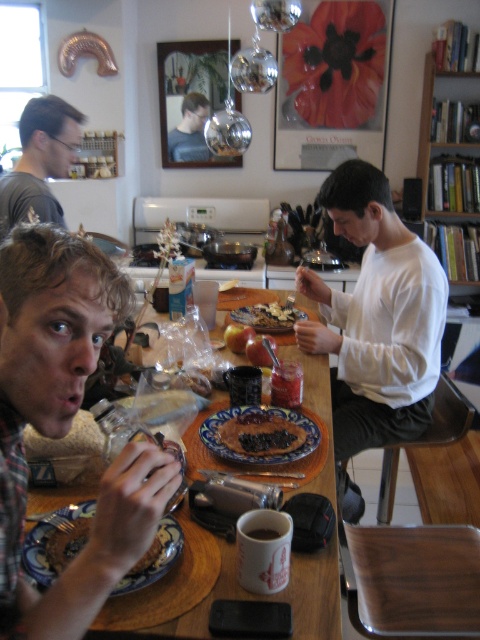
Question: Which point is closer to the camera?

Choices:
 (A) (111, 593)
 (B) (15, 243)
 (C) (199, 120)
 (D) (202, 636)

Answer: (B)

Question: Can you confirm if wooden table at center is positioned above blue glazed plate at center?

Choices:
 (A) yes
 (B) no

Answer: (B)

Question: Does plaid shirt at left have a smaller size compared to blue glazed plate at center?

Choices:
 (A) no
 (B) yes

Answer: (A)

Question: Based on their relative distances, which object is nearer to the plaid shirt at left?

Choices:
 (A) blue glazed plate at center
 (B) blue ceramic plate at lower left
 (C) wooden table at center
 (D) matte gray shirt at upper left

Answer: (B)

Question: Which is nearer to the plaid shirt at left?

Choices:
 (A) matte black shirt at upper center
 (B) matte gray shirt at upper left
 (C) blue glazed plate at center

Answer: (C)

Question: Is plaid shirt at left positioned behind blue ceramic plate at lower left?

Choices:
 (A) yes
 (B) no

Answer: (B)